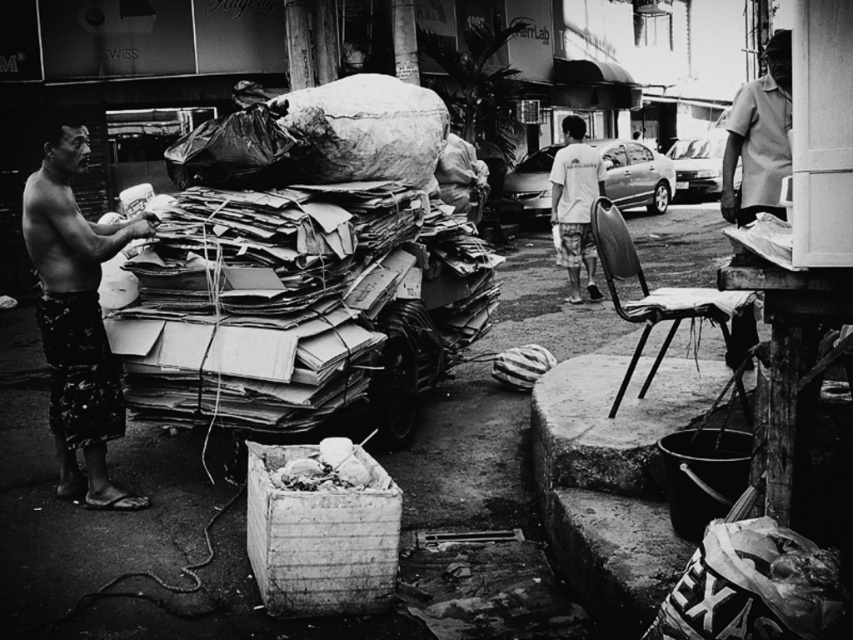
You are a fashion designer observing this urban scene. You notice the patterned fabric shorts at left and the smooth gray shirt at upper right. Which clothing item is shorter in length?

The patterned fabric shorts at left is shorter than the smooth gray shirt at upper right.

You are a photographer analyzing the composition of this black and white photo. The subject is the man on the left. Where exactly is the patterned fabric shorts at left located in terms of coordinates?

The patterned fabric shorts at left is located at coordinates point (76, 317).